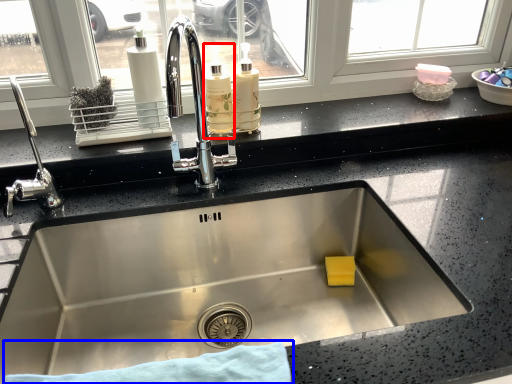
Question: Which object appears closest to the camera in this image, bottle (highlighted by a red box) or bath towel (highlighted by a blue box)?

Choices:
 (A) bottle
 (B) bath towel

Answer: (B)